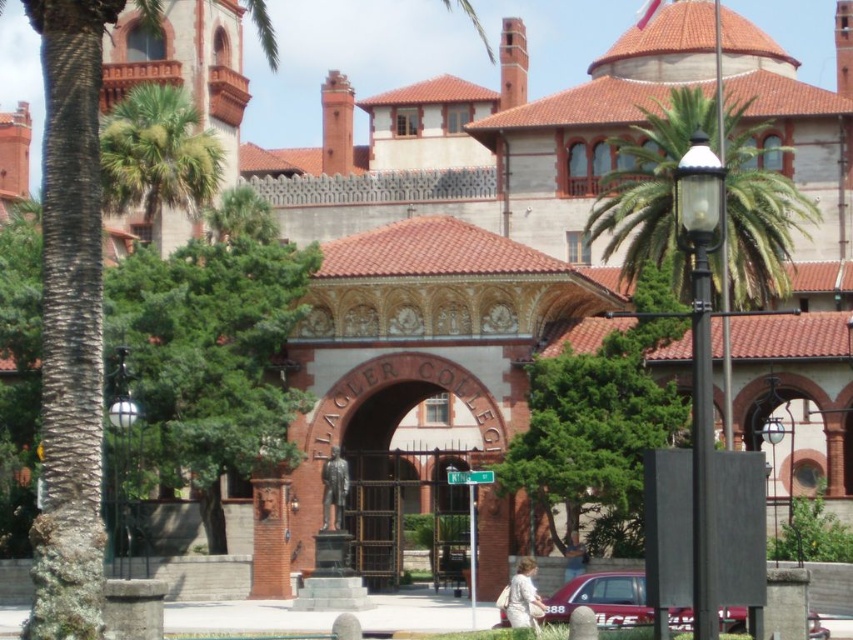
What do you see at coordinates (650, 186) in the screenshot?
I see `green leafy palm at upper right` at bounding box center [650, 186].

Between green leafy palm at upper right and green leafy palm tree at upper left, which one appears on the right side from the viewer's perspective?

green leafy palm at upper right

Locate an element on the screen. This screenshot has width=853, height=640. green leafy palm at upper right is located at coordinates (650, 186).

Who is taller, green leafy palm at upper right or metallic red car at lower center?

Standing taller between the two is green leafy palm at upper right.

In the scene shown: Is green leafy palm at upper right shorter than metallic red car at lower center?

No, green leafy palm at upper right is not shorter than metallic red car at lower center.

Locate an element on the screen. The image size is (853, 640). green leafy palm at upper right is located at coordinates (650, 186).

The width and height of the screenshot is (853, 640). What do you see at coordinates (157, 156) in the screenshot?
I see `green leafy palm tree at upper left` at bounding box center [157, 156].

Is point (192, 150) positioned in front of point (645, 586)?

No.

Image resolution: width=853 pixels, height=640 pixels. Find the location of `green leafy palm tree at upper left`. green leafy palm tree at upper left is located at coordinates (157, 156).

Locate an element on the screen. The height and width of the screenshot is (640, 853). green leafy palm tree at upper left is located at coordinates (157, 156).